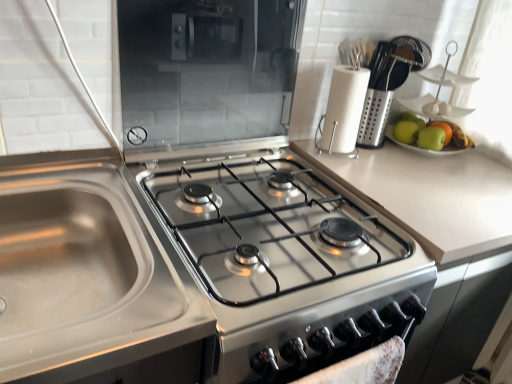
Locate an element on the screen. free space to the left of green matte apple at upper right, which appears as the second apple when viewed from the left is located at coordinates (386, 151).